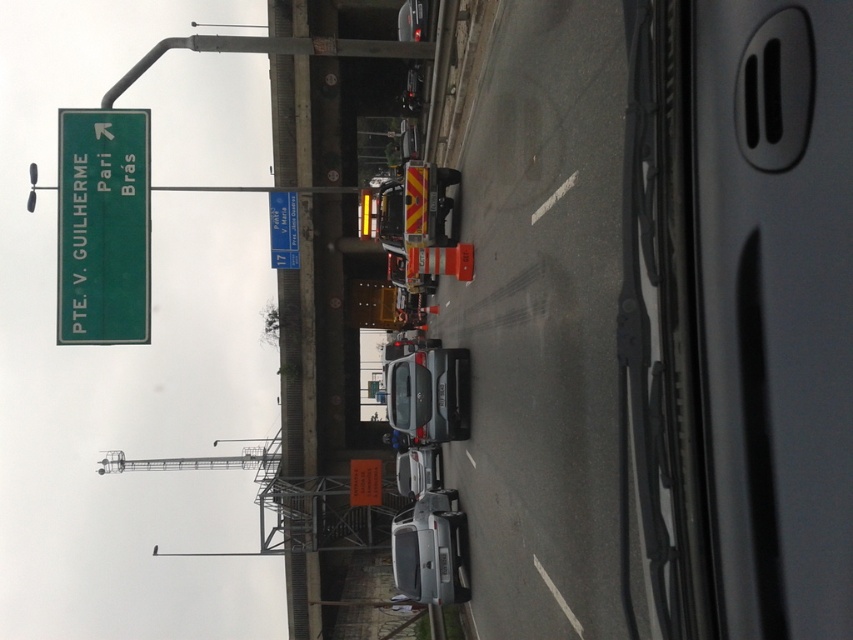
You are sitting in the driver seat of the car and see two points marked on the road ahead. Which point is closer to you? The points are labeled as point (64, 214) and point (424, 504).

Point (64, 214) is closer to the viewer than point (424, 504).

In the scene shown: You are a driver in a car and you see the green matte sign at upper left and the blue plastic road sign at center. Which one is taller?

The green matte sign at upper left is much taller than the blue plastic road sign at center.